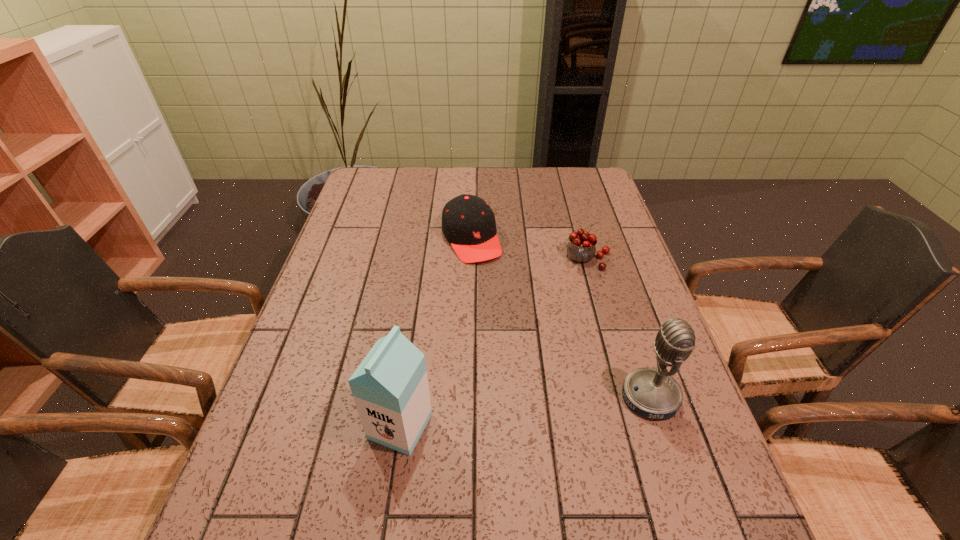
Identify the location of milk carton. This screenshot has height=540, width=960. (390, 388).

You are a GUI agent. You are given a task and a screenshot of the screen. Output one action in this format:
    pyautogui.click(x=<x>, y=<y>)
    Task: Click on the microphone
    
    Given the screenshot: What is the action you would take?
    pyautogui.click(x=654, y=393)

The height and width of the screenshot is (540, 960). Identify the location of cap. (468, 223).

Where is `pot filled with cherries`? The height and width of the screenshot is (540, 960). pot filled with cherries is located at coordinates (581, 248).

Identify the location of vacant position located 0.100m on the back of the milk carton. (410, 362).

Find the location of a particular element. free space located on the front-facing side of the cap is located at coordinates (497, 295).

You are a GUI agent. You are given a task and a screenshot of the screen. Output one action in this format:
    pyautogui.click(x=<x>, y=<y>)
    Task: Click on the vacant area located 0.290m on the front-facing side of the cap
    
    Given the screenshot: What is the action you would take?
    pyautogui.click(x=518, y=336)

Where is `free space located 0.050m on the front-facing side of the cap`? The height and width of the screenshot is (540, 960). free space located 0.050m on the front-facing side of the cap is located at coordinates (487, 274).

Locate an element on the screen. Image resolution: width=960 pixels, height=540 pixels. free space located 0.240m on the handle side of the pot filled with cherries is located at coordinates (574, 334).

Where is `free space located on the handle side of the pot filled with cherries`? This screenshot has width=960, height=540. free space located on the handle side of the pot filled with cherries is located at coordinates (579, 303).